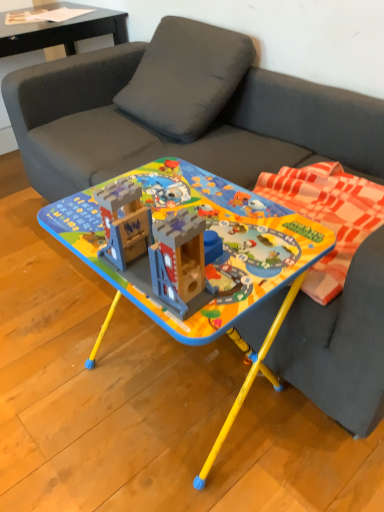
Question: From a real-world perspective, is matte plastic table at center, acting as the 2th table starting from the top, on matte black paper at upper left, placed as the 2th table when sorted from right to left?

Choices:
 (A) yes
 (B) no

Answer: (B)

Question: Is matte plastic table at center, marked as the second table in a back-to-front arrangement, located outside matte black paper at upper left, placed as the 2th table when sorted from right to left?

Choices:
 (A) no
 (B) yes

Answer: (B)

Question: Would you say matte black paper at upper left, arranged as the first table when viewed from the back, is part of matte plastic table at center, marked as the second table in a back-to-front arrangement,'s contents?

Choices:
 (A) yes
 (B) no

Answer: (B)

Question: Is matte plastic table at center, acting as the 2th table starting from the top, in contact with matte black paper at upper left, arranged as the first table when viewed from the back?

Choices:
 (A) no
 (B) yes

Answer: (A)

Question: From a real-world perspective, is matte plastic table at center, positioned as the 2th table in left-to-right order, physically below matte black paper at upper left, acting as the 2th table starting from the bottom?

Choices:
 (A) no
 (B) yes

Answer: (B)

Question: Is point (286, 274) positioned closer to the camera than point (107, 29)?

Choices:
 (A) farther
 (B) closer

Answer: (B)

Question: Is matte plastic table at center, acting as the 2th table starting from the top, bigger or smaller than matte black paper at upper left, which is the 2th table in front-to-back order?

Choices:
 (A) big
 (B) small

Answer: (A)

Question: Is matte plastic table at center, marked as the second table in a back-to-front arrangement, wider or thinner than matte black paper at upper left, which is the 2th table in front-to-back order?

Choices:
 (A) wide
 (B) thin

Answer: (A)

Question: Is matte plastic table at center, acting as the 1th table starting from the front, in front of or behind matte black paper at upper left, placed as the 1th table when sorted from top to bottom, in the image?

Choices:
 (A) front
 (B) behind

Answer: (A)

Question: Is black glossy side table at upper left inside or outside of matte plastic table at center, positioned as the 2th table in left-to-right order?

Choices:
 (A) outside
 (B) inside

Answer: (A)

Question: Is black glossy side table at upper left wider or thinner than matte plastic table at center, acting as the 2th table starting from the top?

Choices:
 (A) wide
 (B) thin

Answer: (A)

Question: From their relative heights in the image, would you say black glossy side table at upper left is taller or shorter than matte plastic table at center, acting as the 1th table starting from the front?

Choices:
 (A) short
 (B) tall

Answer: (B)

Question: In the image, is black glossy side table at upper left positioned in front of or behind matte plastic table at center, marked as the second table in a back-to-front arrangement?

Choices:
 (A) behind
 (B) front

Answer: (A)

Question: Considering the positions of point (264, 218) and point (344, 178), is point (264, 218) closer or farther from the camera than point (344, 178)?

Choices:
 (A) farther
 (B) closer

Answer: (B)

Question: Considering the positions of matte plastic table at center, positioned as the 2th table in left-to-right order, and plaid fabric blanket at right in the image, is matte plastic table at center, positioned as the 2th table in left-to-right order, wider or thinner than plaid fabric blanket at right?

Choices:
 (A) wide
 (B) thin

Answer: (A)